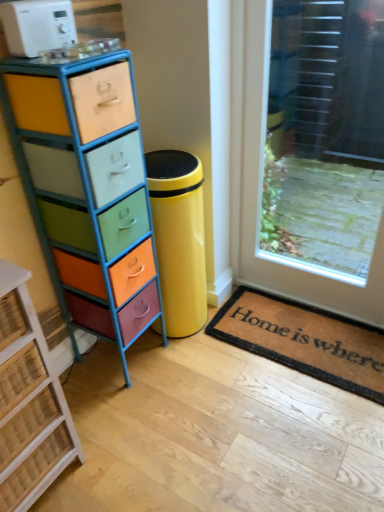
Question: Which is correct: transparent glass door at upper right is inside rustic wicker chest of drawers at left, which is the 1th chest of drawers in left-to-right order, or outside of it?

Choices:
 (A) outside
 (B) inside

Answer: (A)

Question: From the image's perspective, is transparent glass door at upper right above or below rustic wicker chest of drawers at left, the second chest of drawers from the right?

Choices:
 (A) below
 (B) above

Answer: (B)

Question: Which object is the farthest from the white plastic microwave at upper left?

Choices:
 (A) transparent glass door at upper right
 (B) rustic wicker chest of drawers at left, the second chest of drawers from the right
 (C) brown coir mat at lower right
 (D) multicolored painted wood chest of drawers at left, which is the second chest of drawers in left-to-right order

Answer: (C)

Question: Considering the real-world distances, which object is closest to the brown coir mat at lower right?

Choices:
 (A) transparent glass door at upper right
 (B) white plastic microwave at upper left
 (C) rustic wicker chest of drawers at left, which is the 1th chest of drawers in left-to-right order
 (D) multicolored painted wood chest of drawers at left, which is the 1th chest of drawers from right to left

Answer: (A)